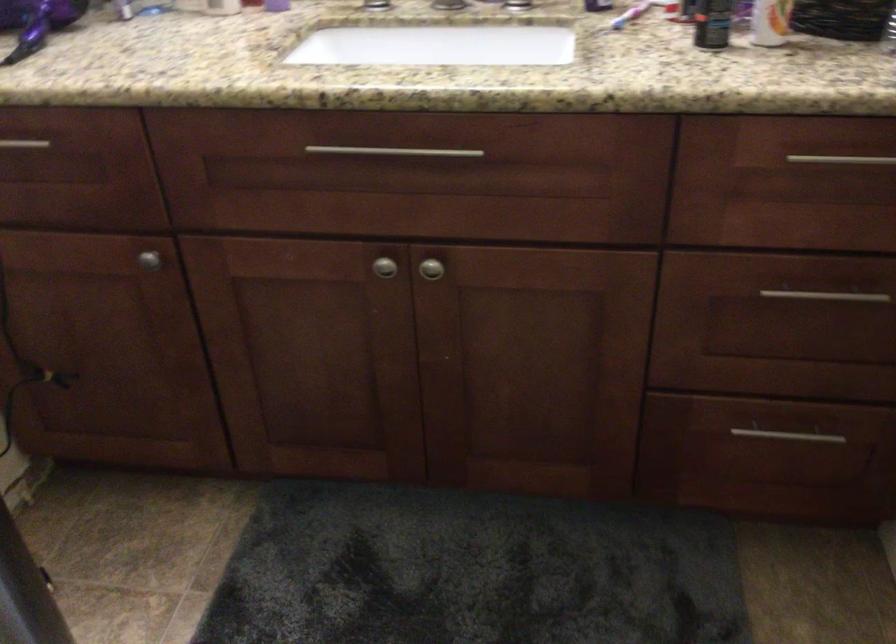
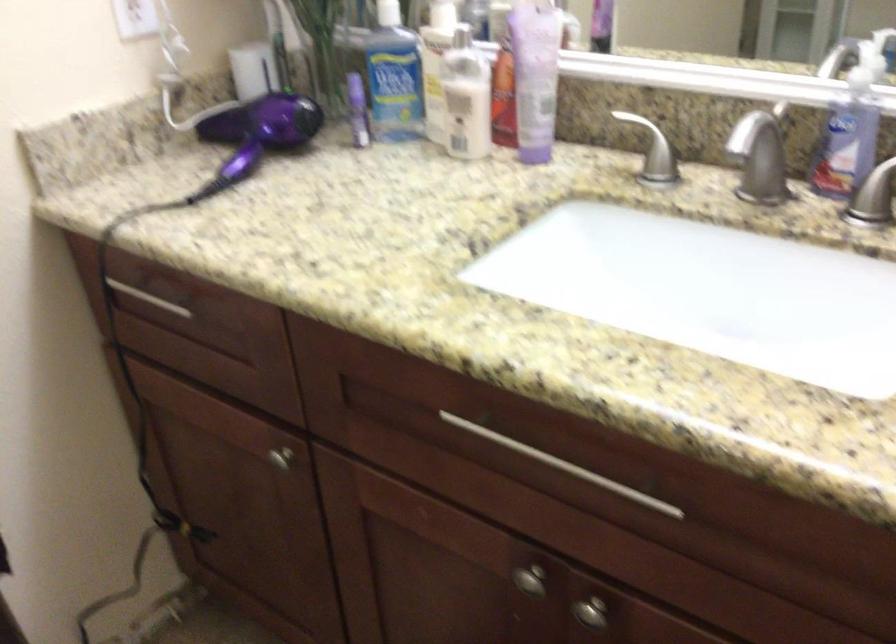
Where in the second image is the point corresponding to the point at 157,261 from the first image?

(280, 459)